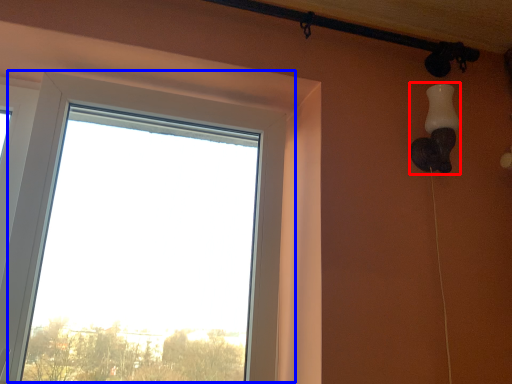
Question: Which object appears closest to the camera in this image, lamp (highlighted by a red box) or window (highlighted by a blue box)?

Choices:
 (A) lamp
 (B) window

Answer: (B)